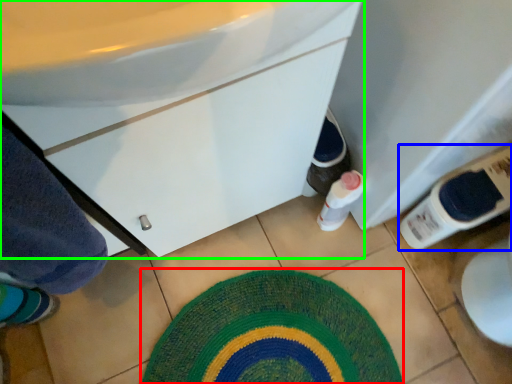
Question: Which object is the farthest from bath mat (highlighted by a red box)? Choose among these: bottle (highlighted by a blue box) or bathroom cabinet (highlighted by a green box).

Choices:
 (A) bottle
 (B) bathroom cabinet

Answer: (B)